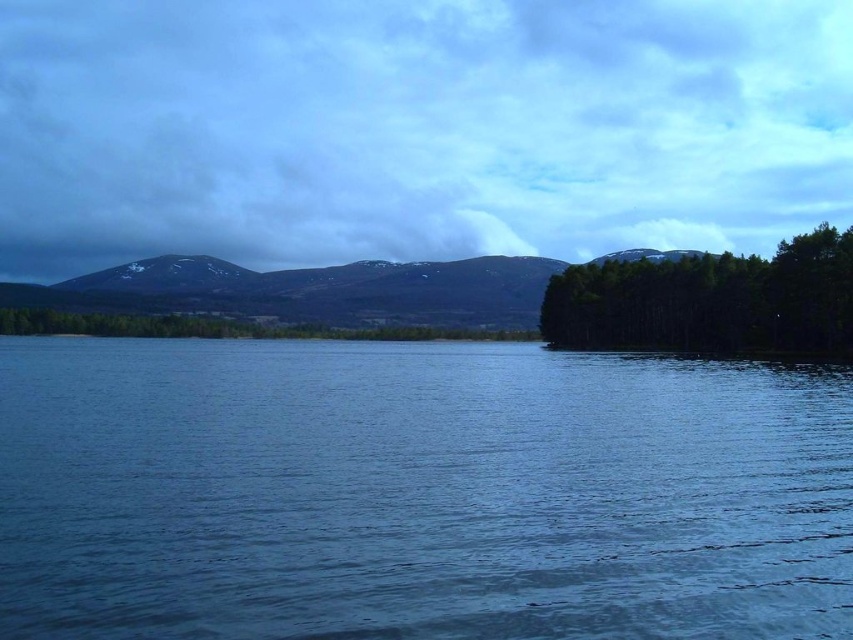
You are standing at the edge of the blue water at center and want to walk towards the green matte trees at right. Which direction should you head to reach them?

You should head upwards because the blue water at center is below the green matte trees at right.

You are a photographer planning to capture the scene from the shore. You notice the blue water at center and the green matte trees at right. Which object will appear taller in your photo?

The green matte trees at right will appear taller in the photo since they have a greater height compared to the blue water at center.

You are a photographer wanting to capture the blue water at center and the green matte trees at right in a single shot. Which object will appear larger in the photo?

The blue water at center will appear larger in the photo because it is closer to the viewer than the green matte trees at right.